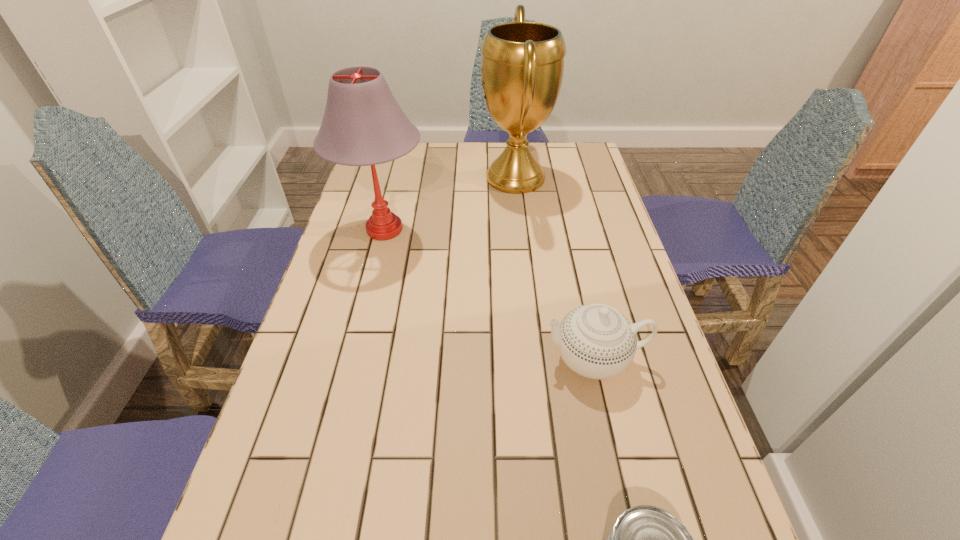
Find the location of a particular element. The height and width of the screenshot is (540, 960). free space between the second shortest object and the leftmost object is located at coordinates (490, 294).

Image resolution: width=960 pixels, height=540 pixels. I want to click on vacant area that lies between the trophy cup and the table lamp, so click(x=450, y=204).

The image size is (960, 540). I want to click on free area in between the leftmost object and the trophy cup, so click(x=450, y=204).

Point out which object is positioned as the third nearest to the nearest object. Please provide its 2D coordinates. Your answer should be formatted as a tuple, i.e. [(x, y)], where the tuple contains the x and y coordinates of a point satisfying the conditions above.

[(522, 65)]

Locate an element on the screen. The width and height of the screenshot is (960, 540). object that is the closest to the second shortest object is located at coordinates (645, 539).